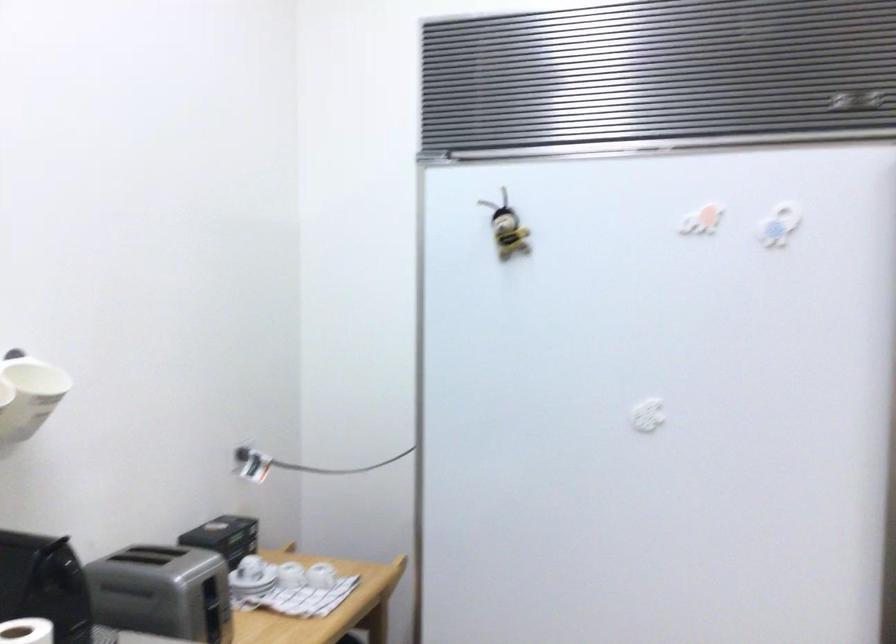
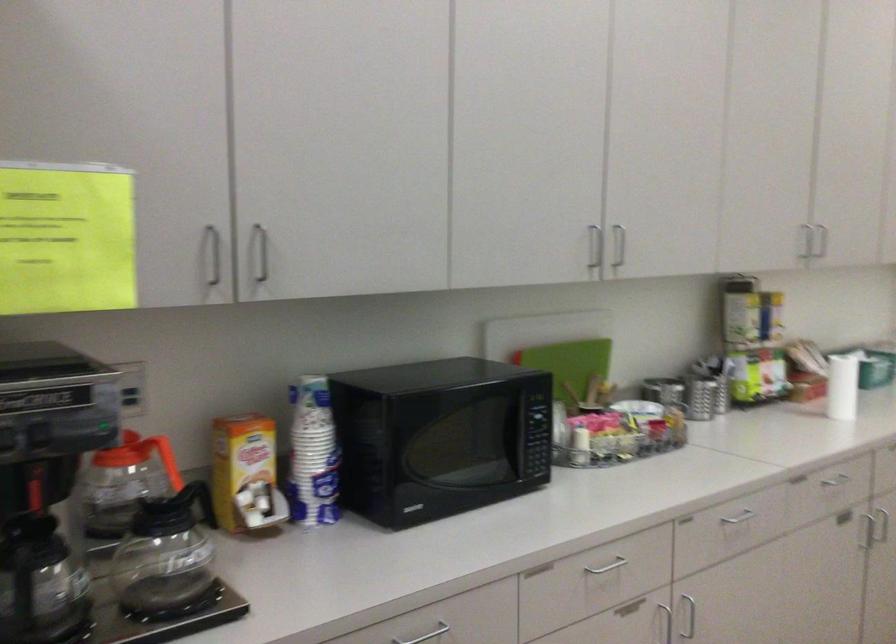
Question: The camera is either moving clockwise (left) or counter-clockwise (right) around the object. The first image is from the beginning of the video and the second image is from the end. Is the camera moving left or right when shooting the video?

Choices:
 (A) Left
 (B) Right

Answer: (A)